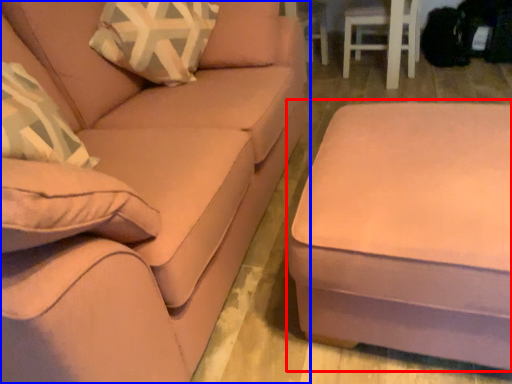
Question: Which object is further to the camera taking this photo, table (highlighted by a red box) or studio couch (highlighted by a blue box)?

Choices:
 (A) table
 (B) studio couch

Answer: (A)